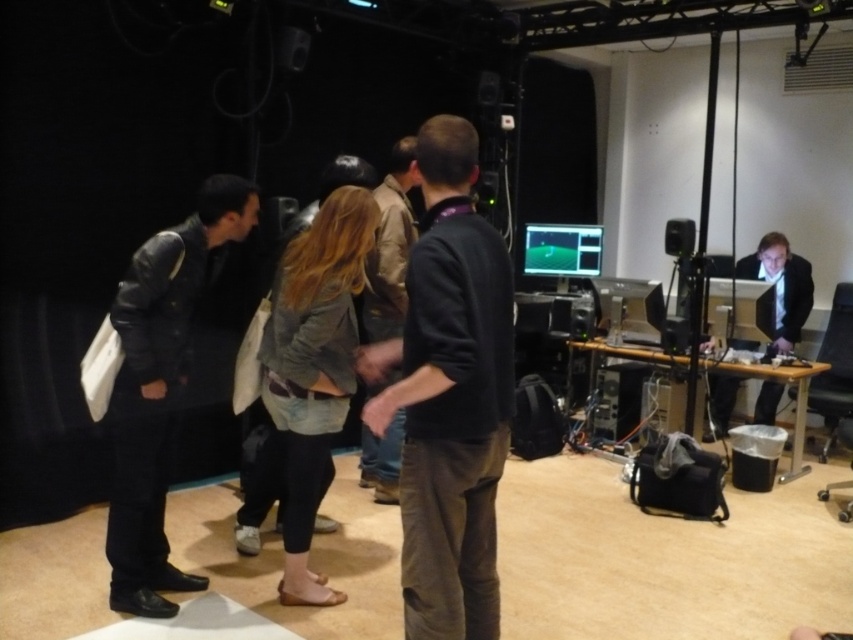
Who is shorter, dark gray sweater at center or denim jacket at center?

dark gray sweater at center

Does dark gray sweater at center have a lesser height compared to denim jacket at center?

Indeed, dark gray sweater at center has a lesser height compared to denim jacket at center.

This screenshot has width=853, height=640. I want to click on dark gray sweater at center, so click(x=450, y=396).

Is point (387, 244) positioned behind point (793, 339)?

No, it is not.

Describe the element at coordinates (390, 248) in the screenshot. The width and height of the screenshot is (853, 640). I see `brown leather jacket at center` at that location.

This screenshot has width=853, height=640. Find the location of `brown leather jacket at center`. brown leather jacket at center is located at coordinates (390, 248).

Does leather jacket at left have a smaller size compared to denim jacket at center?

Correct, leather jacket at left occupies less space than denim jacket at center.

Does leather jacket at left have a lesser height compared to denim jacket at center?

Incorrect, leather jacket at left's height does not fall short of denim jacket at center's.

Does point (187, 259) lie in front of point (341, 280)?

That is False.

At what (x,y) coordinates should I click in order to perform the action: click on leather jacket at left. Please return your answer as a coordinate pair (x, y). Looking at the image, I should click on (x=160, y=388).